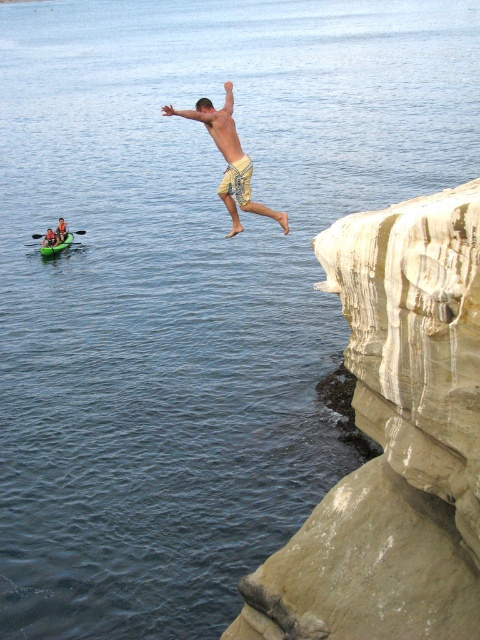
You are a photographer capturing the cliff diver. You notice two pairs of shorts in the scene. Which pair of shorts, the yellow striped shorts at center or the tan textured shorts at upper center, appears larger in height?

The yellow striped shorts at center appears larger in height than the tan textured shorts at upper center because it is taller according to the description.

You are a photographer trying to capture the perfect shot of the man leaping off the cliff. You notice the tan textured shorts at upper center and the tan textured shorts at center in your viewfinder. Based on their positions, how far apart are these two points in the image?

The tan textured shorts at upper center and the tan textured shorts at center are 17.38 inches apart from each other.